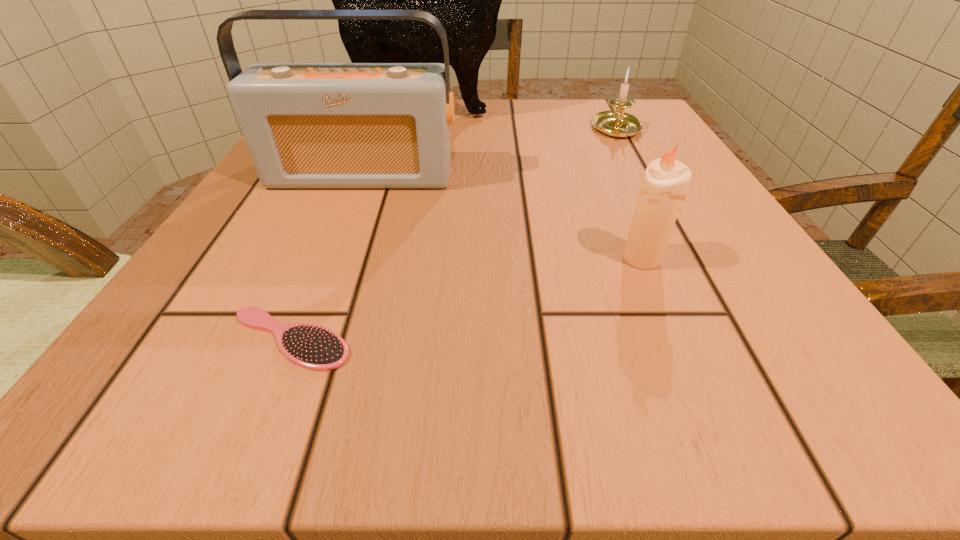
Identify the location of candle holder positioned at the right edge. (618, 124).

You are a GUI agent. You are given a task and a screenshot of the screen. Output one action in this format:
    pyautogui.click(x=<x>, y=<y>)
    Task: Click on the object at the far left corner
    The width and height of the screenshot is (960, 540).
    Given the screenshot: What is the action you would take?
    pyautogui.click(x=466, y=0)

I want to click on object at the near left corner, so click(x=310, y=346).

Find the location of a particular element. The width and height of the screenshot is (960, 540). object at the far right corner is located at coordinates (618, 124).

Identify the location of blank space at the far edge. (482, 145).

Identify the location of vacant area at the near edge of the desktop. This screenshot has width=960, height=540. (293, 410).

In the image, there is a desktop. Identify the location of vacant region at the left edge. (180, 309).

The image size is (960, 540). In order to click on vacant space at the right edge of the desktop in this screenshot , I will do `click(705, 226)`.

This screenshot has width=960, height=540. In the image, there is a desktop. In order to click on free space at the near right corner in this screenshot , I will do `click(737, 419)`.

I want to click on vacant space in between the hairbrush and the fourth tallest object, so click(453, 234).